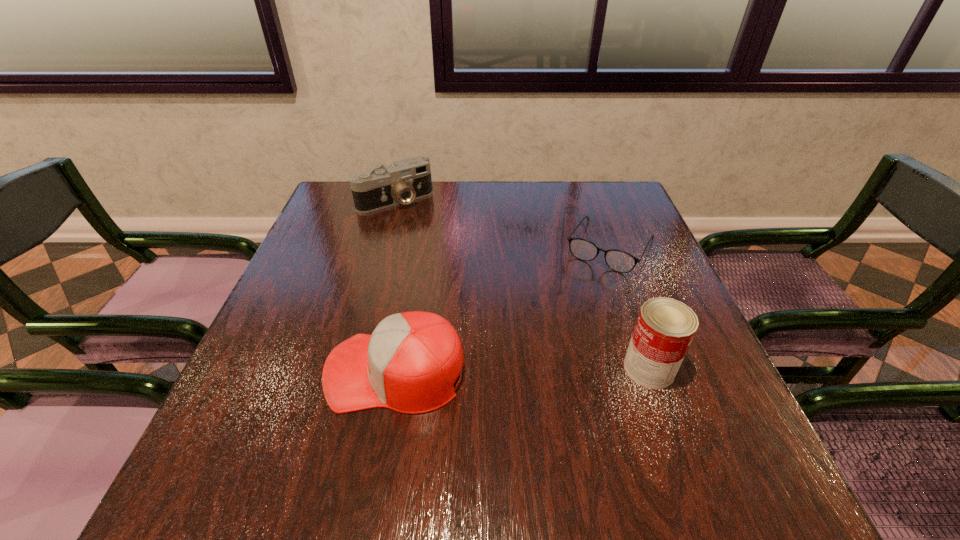
I want to click on baseball cap, so coord(409,364).

You are a GUI agent. You are given a task and a screenshot of the screen. Output one action in this format:
    pyautogui.click(x=<x>, y=<y>)
    Task: Click on the can
    
    Given the screenshot: What is the action you would take?
    pyautogui.click(x=665, y=327)

At what (x,y) coordinates should I click in order to perform the action: click on the shortest object. Please return your answer as a coordinate pair (x, y). Looking at the image, I should click on (620, 261).

I want to click on the second farthest object, so pyautogui.click(x=620, y=261).

Locate an element on the screen. camera is located at coordinates (406, 180).

At what (x,y) coordinates should I click in order to perform the action: click on free space located on the front-facing side of the baseball cap. Please return your answer as a coordinate pair (x, y). The height and width of the screenshot is (540, 960). Looking at the image, I should click on tap(253, 372).

What are the coordinates of `vacant space located on the front-facing side of the baseball cap` in the screenshot? It's located at (259, 372).

This screenshot has width=960, height=540. I want to click on free spot located on the front-facing side of the baseball cap, so click(296, 372).

You are a GUI agent. You are given a task and a screenshot of the screen. Output one action in this format:
    pyautogui.click(x=<x>, y=<y>)
    Task: Click on the vacant space located 0.060m on the front label of the tallest object
    This screenshot has height=540, width=960.
    Given the screenshot: What is the action you would take?
    pyautogui.click(x=705, y=368)

This screenshot has height=540, width=960. I want to click on blank space located on the front-facing side of the spectacles, so click(534, 377).